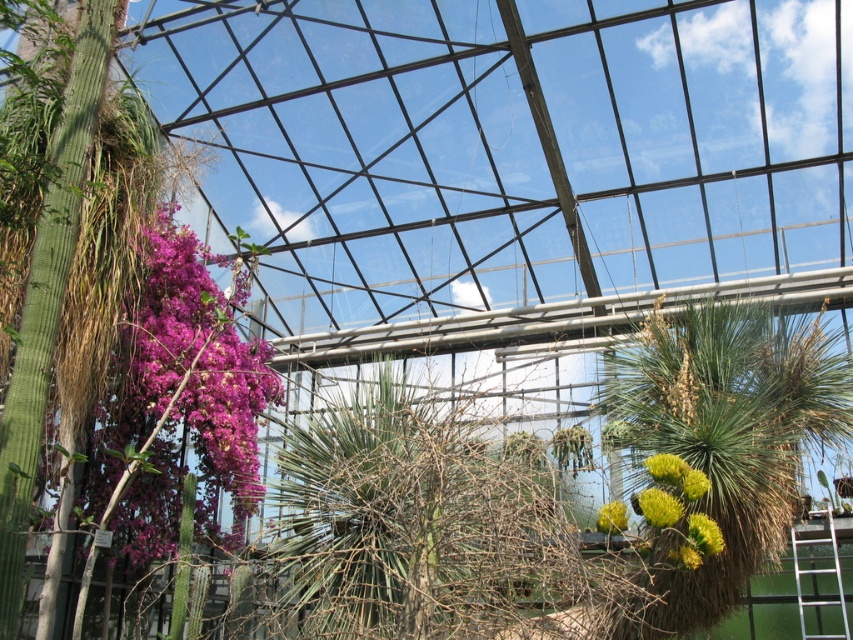
You are a gardener checking the plants in the greenhouse. You notice the purple matte flowers at left and the yellow fuzzy flower at center. Which one is positioned higher in the greenhouse?

The purple matte flowers at left are positioned higher than the yellow fuzzy flower at center.

You are a gardener who wants to place a new plant between the purple matte flowers at left and the yellow fuzzy flower at center. Which flower should you use as a reference for height to ensure the new plant doesn not block sunlight from reaching the shorter one?

The yellow fuzzy flower at center is shorter than the purple matte flowers at left. To ensure the new plant doesn not block sunlight, you should use the yellow fuzzy flower at center as the reference for height so the new plant doesn t exceed its height.

You are a gardener who wants to water the yellow fuzzy flower at center and the purple matte flowers at left. Since you can only reach the ones in front, which one should you water first?

The purple matte flowers at left are in front of the yellow fuzzy flower at center, so you should water the purple matte flowers at left first before reaching the yellow fuzzy flower at center.